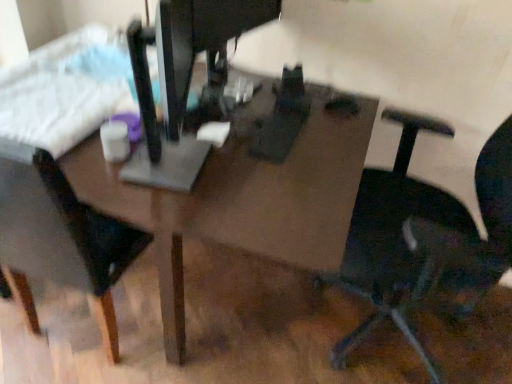
Locate an element on the screen. Image resolution: width=512 pixels, height=384 pixels. free point above matte brown table at center (from a real-world perspective) is located at coordinates (199, 130).